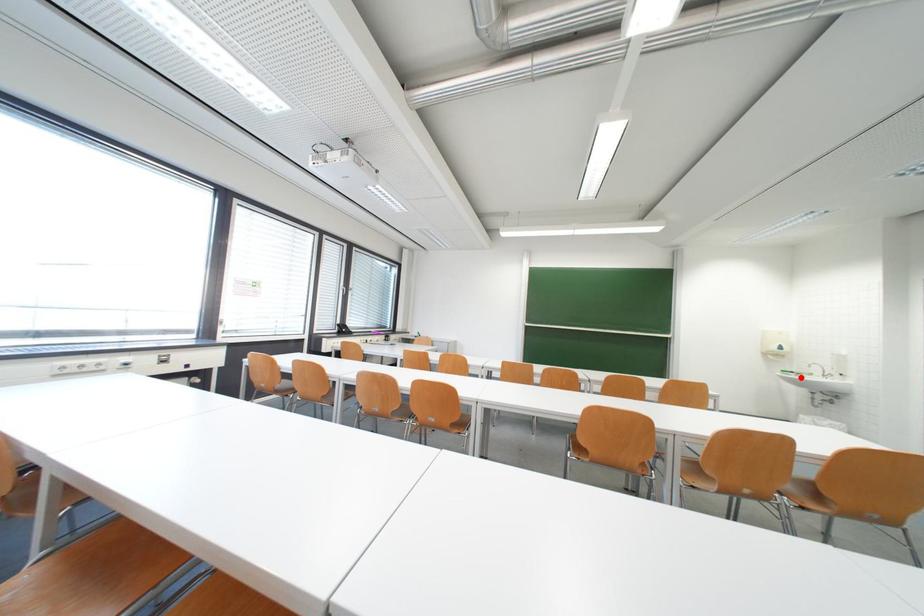
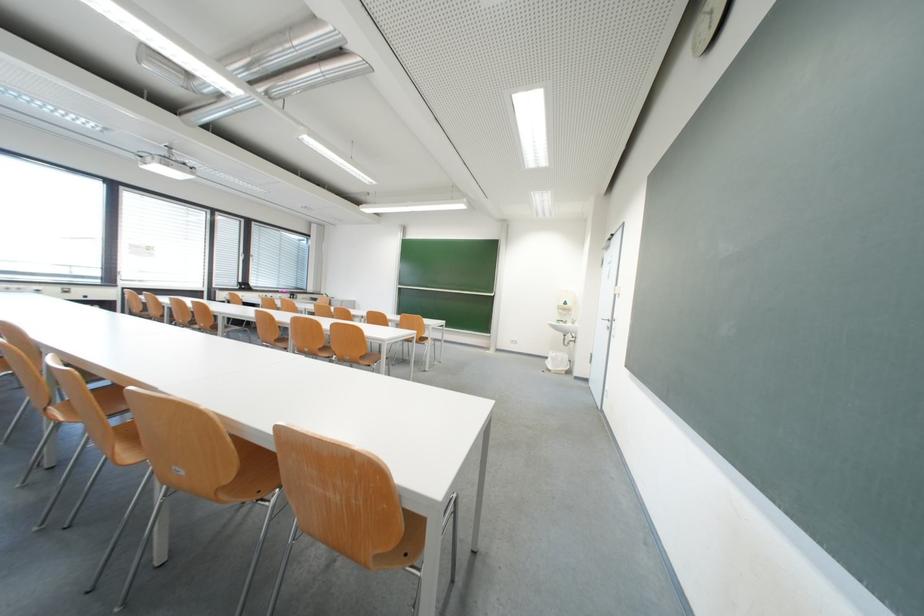
Question: I am providing you with two images of the same scene from different viewpoints. In image1, a red point is highlighted. Considering the same 3D point in image2, which of the following is correct?

Choices:
 (A) It is closer
 (B) It is farther

Answer: (A)